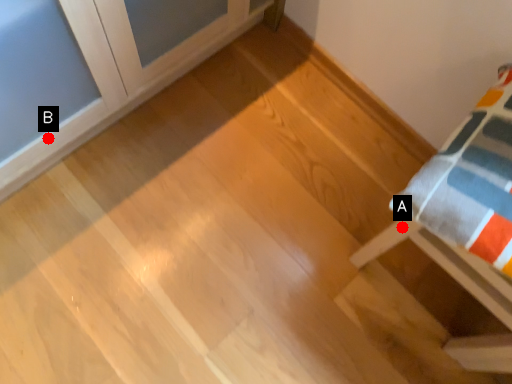
Question: Two points are circled on the image, labeled by A and B beside each circle. Which point is closer to the camera?

Choices:
 (A) A is closer
 (B) B is closer

Answer: (A)